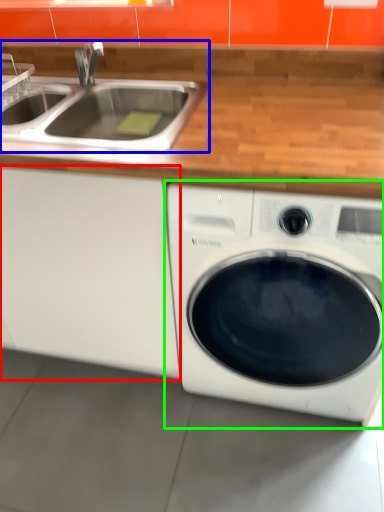
Question: Based on their relative distances, which object is nearer to cabinetry (highlighted by a red box)? Choose from sink (highlighted by a blue box) and washing machine (highlighted by a green box).

Choices:
 (A) sink
 (B) washing machine

Answer: (B)